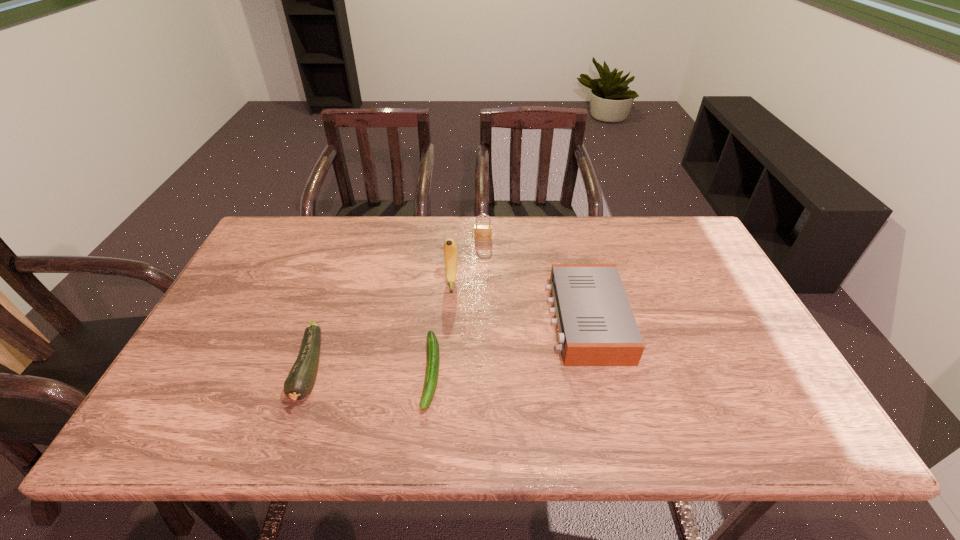
You are a GUI agent. You are given a task and a screenshot of the screen. Output one action in this format:
    pyautogui.click(x=<x>, y=<y>)
    Task: Click on the empty space between the radio receiver and the fourth object from left to right
    This screenshot has width=960, height=540.
    Given the screenshot: What is the action you would take?
    pyautogui.click(x=535, y=280)

Locate which object ranks second in proximity to the shortest object. Please provide its 2D coordinates. Your answer should be formatted as a tuple, i.e. [(x, y)], where the tuple contains the x and y coordinates of a point satisfying the conditions above.

[(301, 378)]

Identify which object is the third nearest to the rightmost object. Please provide its 2D coordinates. Your answer should be formatted as a tuple, i.e. [(x, y)], where the tuple contains the x and y coordinates of a point satisfying the conditions above.

[(433, 359)]

Locate an element on the screen. Image resolution: width=960 pixels, height=540 pixels. free space that satisfies the following two spatial constraints: 1. on the control panel of the radio receiver; 2. on the front-facing side of the shortest object is located at coordinates (599, 372).